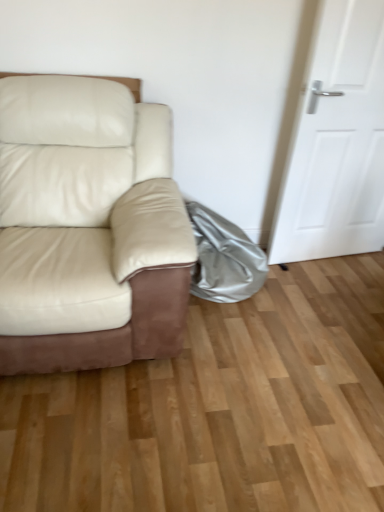
Where is `vacant space in front of shiny metallic bag at lower right`? vacant space in front of shiny metallic bag at lower right is located at coordinates (247, 331).